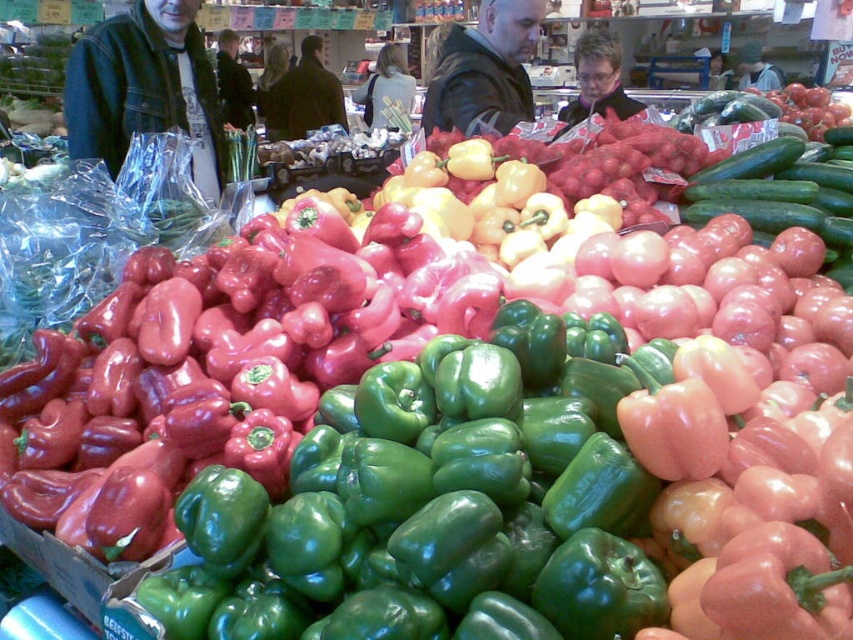
Based on the photo, you are a customer at the store and want to pick up the dark blue denim jacket at upper left. However, there is an obstacle blocking your path. Which item is in front of it?

The denim jacket at upper left is closer to the viewer than the dark blue denim jacket at upper left, so the denim jacket at upper left is blocking the path to the dark blue denim jacket at upper left.

You are a customer trying to decide between two jackets. You see a denim jacket at center and a dark blue denim jacket at upper left. Which of these two jackets is wider?

The denim jacket at center is wider than the dark blue denim jacket at upper left.